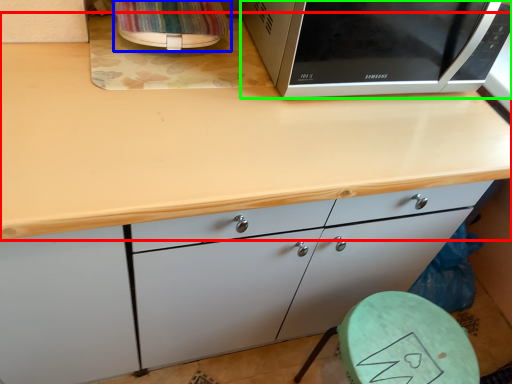
Question: Which object is positioned farthest from countertop (highlighted by a red box)? Select from appliance (highlighted by a blue box) and microwave oven (highlighted by a green box).

Choices:
 (A) appliance
 (B) microwave oven

Answer: (A)